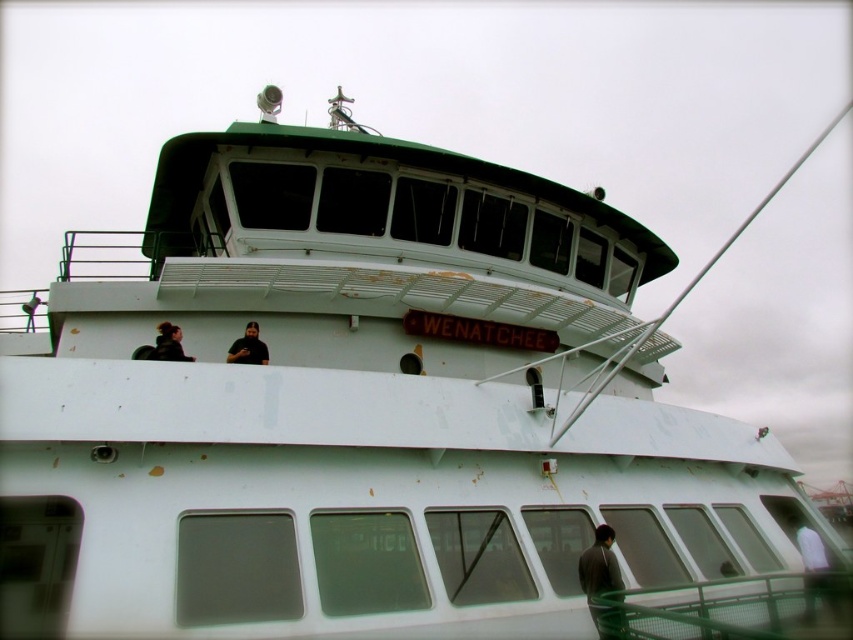
Who is shorter, dark gray sweater at lower right or matte black shirt at upper left?

matte black shirt at upper left

Based on the photo, can you confirm if dark gray sweater at lower right is positioned to the right of matte black shirt at upper left?

Indeed, dark gray sweater at lower right is positioned on the right side of matte black shirt at upper left.

Between point (604, 563) and point (155, 346), which one is positioned behind?

Point (155, 346)

You are a GUI agent. You are given a task and a screenshot of the screen. Output one action in this format:
    pyautogui.click(x=<x>, y=<y>)
    Task: Click on the dark gray sweater at lower right
    The image size is (853, 640).
    Given the screenshot: What is the action you would take?
    pyautogui.click(x=602, y=580)

Is black matte shirt at upper center above matte black shirt at upper left?

Correct, black matte shirt at upper center is located above matte black shirt at upper left.

Which is above, black matte shirt at upper center or matte black shirt at upper left?

Positioned higher is black matte shirt at upper center.

Is point (251, 356) in front of point (161, 326)?

Yes.

Identify the location of black matte shirt at upper center. This screenshot has width=853, height=640. (248, 348).

Can you confirm if dark gray sweater at lower right is positioned below black matte shirt at upper center?

Yes.

Who is lower down, dark gray sweater at lower right or black matte shirt at upper center?

dark gray sweater at lower right is lower down.

Between point (606, 563) and point (252, 340), which one is positioned behind?

Point (252, 340)

Where is `dark gray sweater at lower right`? dark gray sweater at lower right is located at coordinates (602, 580).